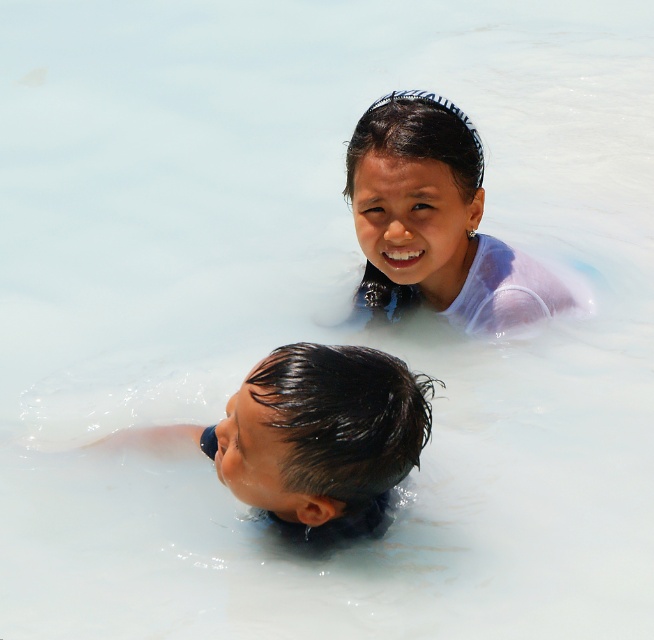
Question: Which of the following is the farthest from the observer?

Choices:
 (A) white matte hair at upper center
 (B) wet black hair at lower center

Answer: (A)

Question: Is wet black hair at lower center to the right of white matte hair at upper center from the viewer's perspective?

Choices:
 (A) no
 (B) yes

Answer: (A)

Question: Which object appears closest to the camera in this image?

Choices:
 (A) wet black hair at lower center
 (B) white matte hair at upper center

Answer: (A)

Question: Does wet black hair at lower center appear on the right side of white matte hair at upper center?

Choices:
 (A) no
 (B) yes

Answer: (A)

Question: Is wet black hair at lower center thinner than white matte hair at upper center?

Choices:
 (A) no
 (B) yes

Answer: (A)